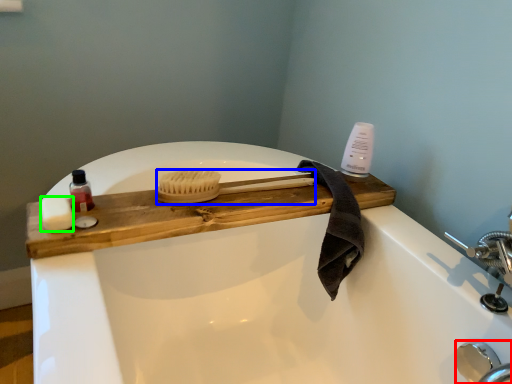
Question: Estimate the real-world distances between objects in this image. Which object is closer to faucet (highlighted by a red box), brush (highlighted by a blue box) or soap (highlighted by a green box)?

Choices:
 (A) brush
 (B) soap

Answer: (A)